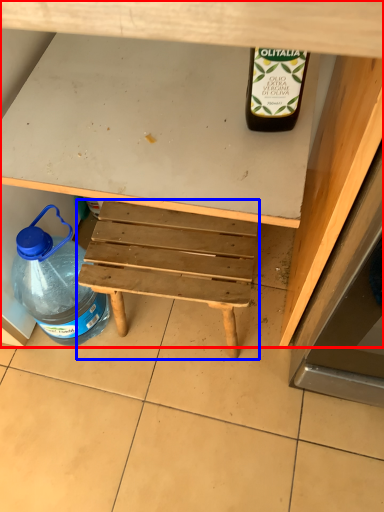
Question: Which object appears farthest to the camera in this image, desk (highlighted by a red box) or stool (highlighted by a blue box)?

Choices:
 (A) desk
 (B) stool

Answer: (B)